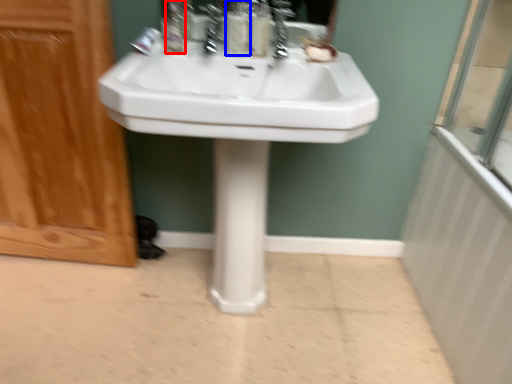
Question: Which object is closer to the camera taking this photo, mouthwash (highlighted by a red box) or soap dispenser (highlighted by a blue box)?

Choices:
 (A) mouthwash
 (B) soap dispenser

Answer: (A)